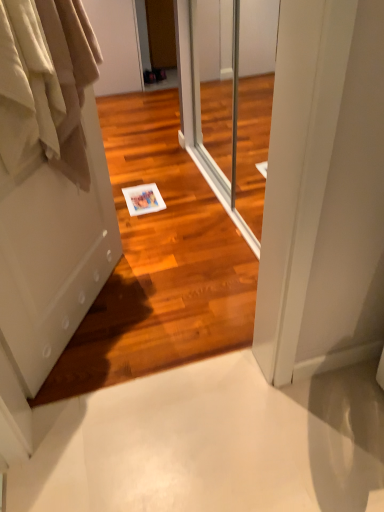
Where is `vacant space underneath white matte door at left (from a real-world perspective)`? vacant space underneath white matte door at left (from a real-world perspective) is located at coordinates (88, 315).